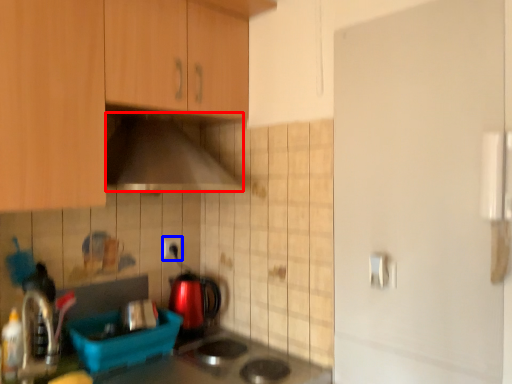
Question: Which of the following is the farthest to the observer, home appliance (highlighted by a red box) or electric outlet (highlighted by a blue box)?

Choices:
 (A) home appliance
 (B) electric outlet

Answer: (B)